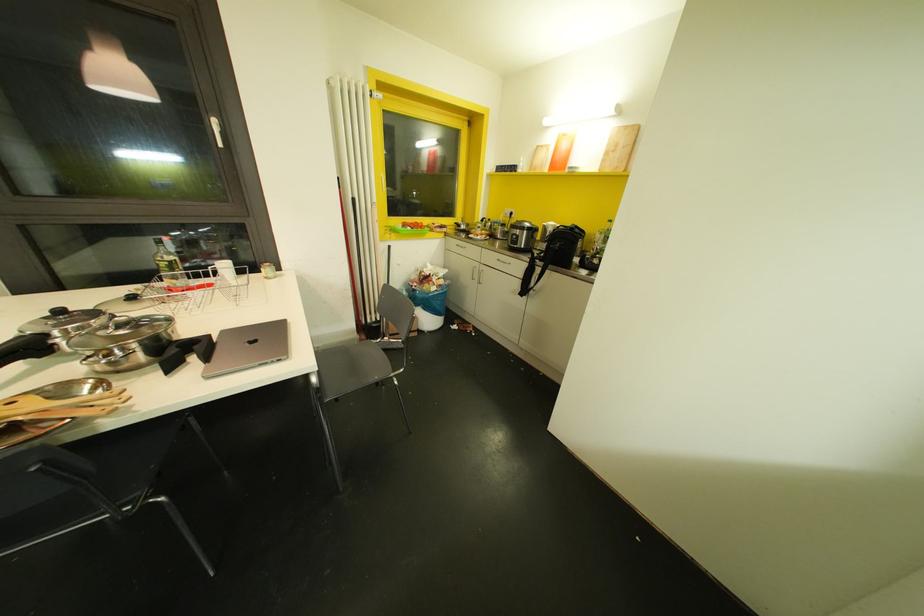
You are a GUI agent. You are given a task and a screenshot of the screen. Output one action in this format:
    pyautogui.click(x=<x>, y=<y>)
    Task: Click on the chair sitting surface
    
    Given the screenshot: What is the action you would take?
    pyautogui.click(x=345, y=368)